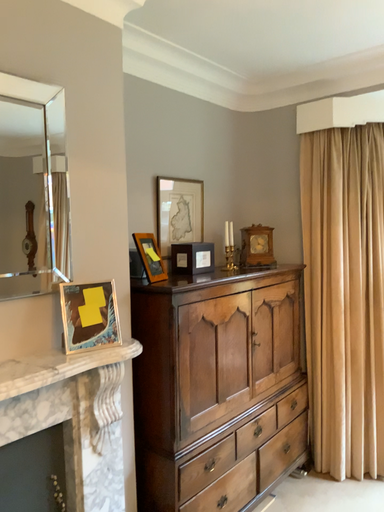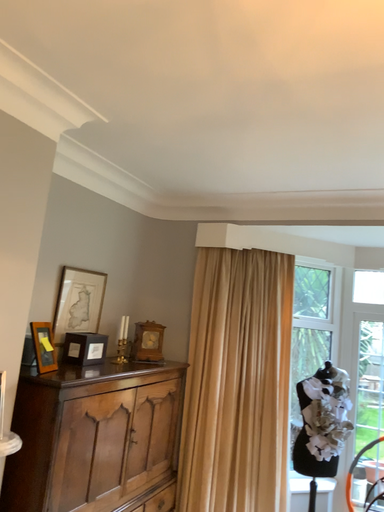
Question: Which way did the camera rotate in the video?

Choices:
 (A) rotated right
 (B) rotated left

Answer: (A)